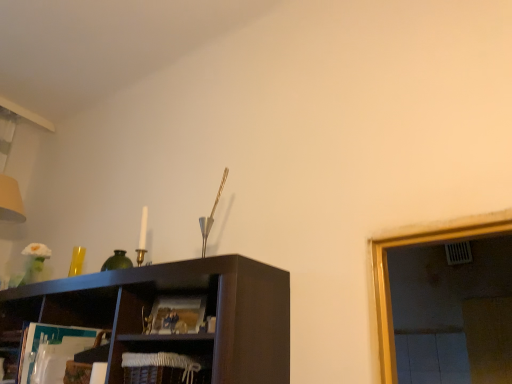
Question: Considering their positions, is matte brown magazine at center located in front of or behind woven brown basket at lower center?

Choices:
 (A) behind
 (B) front

Answer: (A)

Question: From the image's perspective, relative to woven brown basket at lower center, is matte brown magazine at center above or below?

Choices:
 (A) above
 (B) below

Answer: (A)

Question: Is point pos(167,329) positioned closer to the camera than point pos(205,377)?

Choices:
 (A) farther
 (B) closer

Answer: (A)

Question: From the image's perspective, is woven brown basket at lower center positioned above or below matte brown magazine at center?

Choices:
 (A) above
 (B) below

Answer: (B)

Question: Based on their sizes in the image, would you say woven brown basket at lower center is bigger or smaller than matte brown magazine at center?

Choices:
 (A) big
 (B) small

Answer: (A)

Question: Considering the positions of woven brown basket at lower center and matte brown magazine at center in the image, is woven brown basket at lower center wider or thinner than matte brown magazine at center?

Choices:
 (A) wide
 (B) thin

Answer: (A)

Question: Would you say woven brown basket at lower center is to the left or to the right of matte brown magazine at center in the picture?

Choices:
 (A) right
 (B) left

Answer: (B)